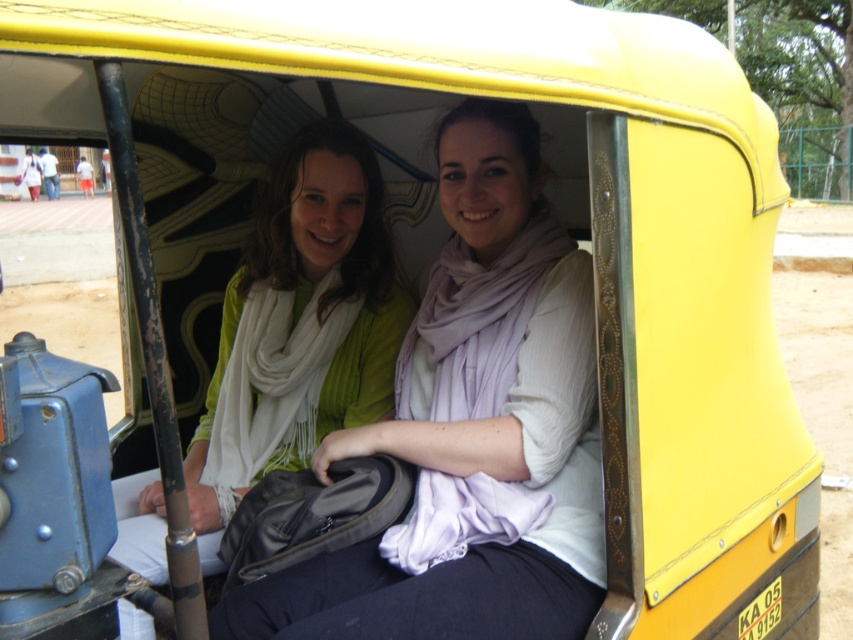
Question: Which point appears closest to the camera in this image?

Choices:
 (A) (396, 348)
 (B) (287, 636)

Answer: (B)

Question: Is matte white scarf at center bigger than matte green sweater at center?

Choices:
 (A) no
 (B) yes

Answer: (B)

Question: Which point is farther to the camera?

Choices:
 (A) (465, 362)
 (B) (323, 296)

Answer: (B)

Question: Is matte white scarf at center below matte green sweater at center?

Choices:
 (A) yes
 (B) no

Answer: (A)

Question: Which object is closer to the camera taking this photo?

Choices:
 (A) matte white scarf at center
 (B) matte green sweater at center

Answer: (A)

Question: Can you confirm if matte white scarf at center is positioned to the left of matte green sweater at center?

Choices:
 (A) no
 (B) yes

Answer: (A)